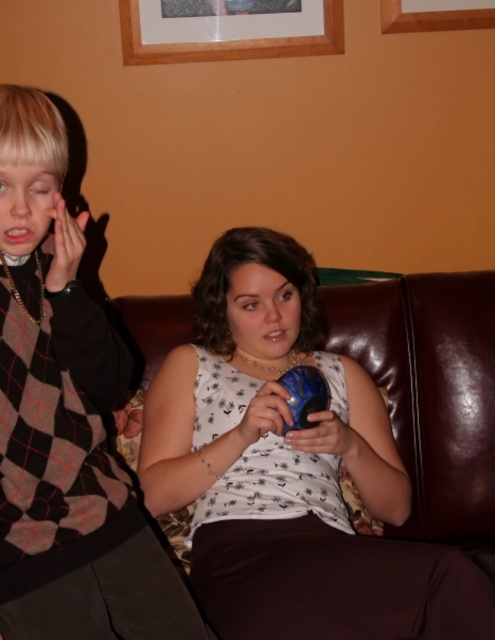
Based on the scene description, where is the white fabric shirt at center in relation to the wooden picture frame at upper center?

The white fabric shirt at center is to the right of the wooden picture frame at upper center.

Looking at this image, you are a fashion designer observing the image. You need to determine the spatial relationship between the white fabric shirt at center and the checkered fabric sweater at left. Which one is positioned lower in the image?

The white fabric shirt at center is located below the checkered fabric sweater at left, so it is positioned lower in the image.

In the scene shown: You are a tailor measuring distances between clothing items in a living room. You see the checkered fabric sweater at left and the wooden frame at upper center. Which one is closer to you?

The checkered fabric sweater at left is closer to you since it is 5.33 feet away from the wooden frame at upper center, meaning the sweater is nearer than the frame.